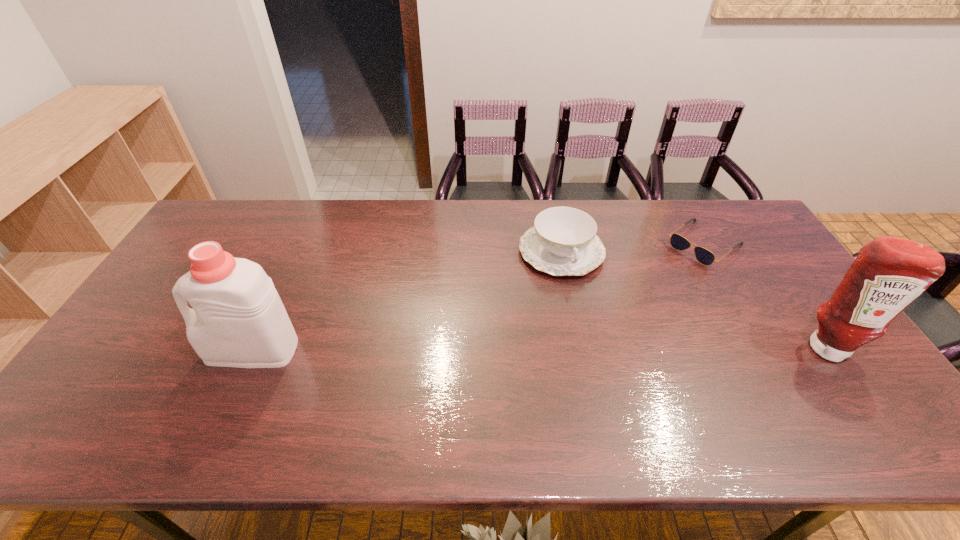
The width and height of the screenshot is (960, 540). I want to click on detergent, so click(238, 320).

Identify the location of condiment. This screenshot has width=960, height=540. (889, 273).

At what (x,y) coordinates should I click in order to perform the action: click on the second shortest object. Please return your answer as a coordinate pair (x, y). The width and height of the screenshot is (960, 540). Looking at the image, I should click on (563, 241).

Where is `chinaware`? chinaware is located at coordinates (563, 241).

Where is `sunglasses`? This screenshot has height=540, width=960. sunglasses is located at coordinates (705, 257).

The image size is (960, 540). What are the coordinates of `free space located on the handle side of the leftmost object` in the screenshot? It's located at (125, 350).

Find the location of a particular element. This screenshot has height=540, width=960. vacant space positioned 0.100m on the handle side of the leftmost object is located at coordinates (171, 350).

Where is `vacant space located on the handle side of the leftmost object`? The image size is (960, 540). vacant space located on the handle side of the leftmost object is located at coordinates (163, 350).

Locate an element on the screen. The height and width of the screenshot is (540, 960). free spot located on the back of the condiment is located at coordinates (800, 307).

You are a GUI agent. You are given a task and a screenshot of the screen. Output one action in this format:
    pyautogui.click(x=<x>, y=<y>)
    Task: Click on the blank space located 0.240m on the handle side of the chinaware
    Image resolution: width=960 pixels, height=540 pixels.
    Given the screenshot: What is the action you would take?
    pyautogui.click(x=598, y=343)